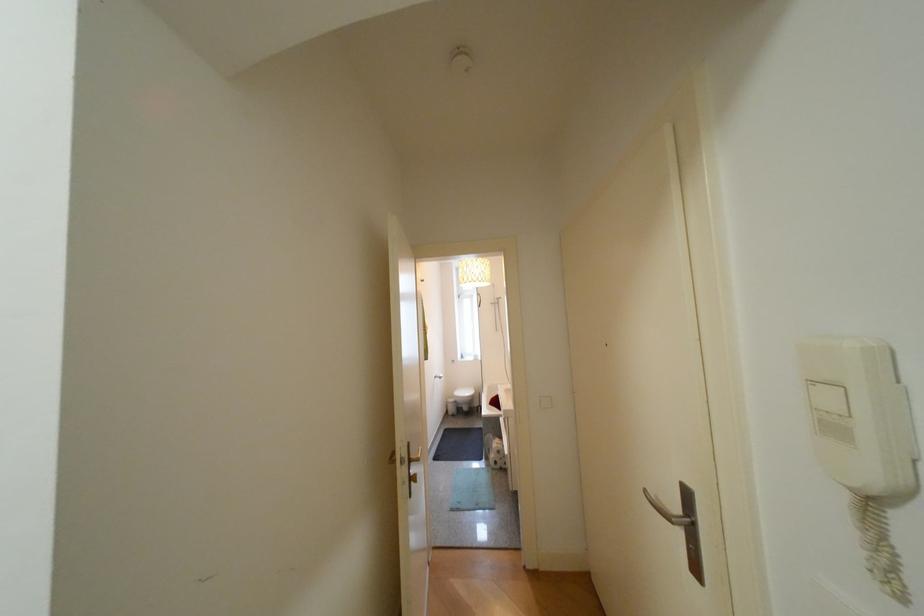
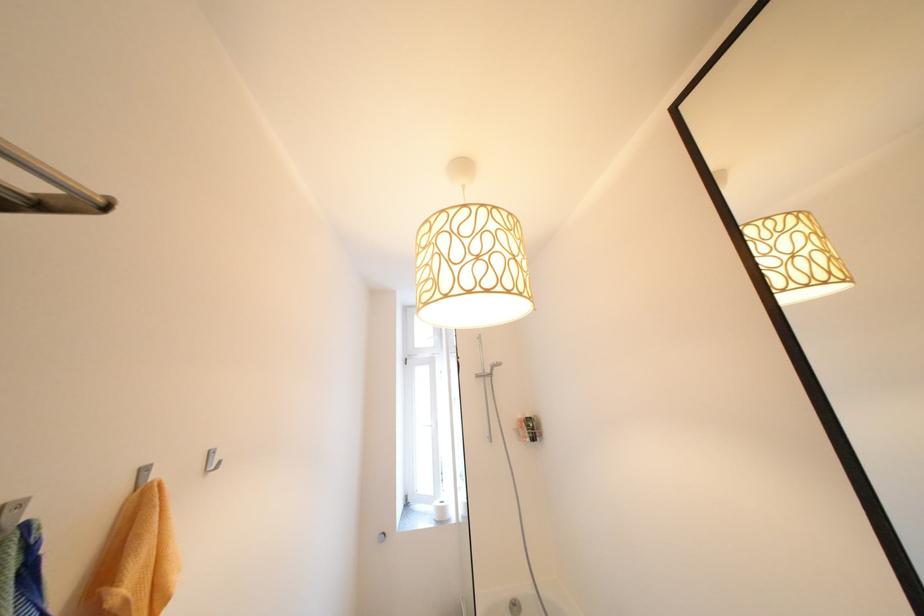
In the second image, find the point that corresponds to pixel 503 302 in the first image.

(490, 371)